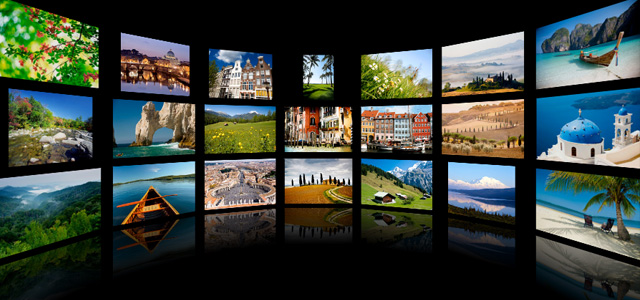
Where is `leftside tv screens`? The image size is (640, 300). leftside tv screens is located at coordinates (54, 56), (57, 107), (61, 197), (156, 179), (150, 122), (147, 62).